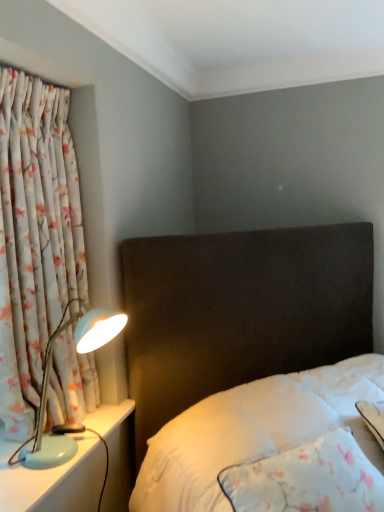
Question: In the image, is light blue plastic lamp at left on the left side or the right side of floral fabric curtain at left?

Choices:
 (A) left
 (B) right

Answer: (B)

Question: Relative to floral fabric curtain at left, is light blue plastic lamp at left in front or behind?

Choices:
 (A) front
 (B) behind

Answer: (B)

Question: From a real-world perspective, relative to floral fabric curtain at left, is light blue plastic lamp at left vertically above or below?

Choices:
 (A) above
 (B) below

Answer: (B)

Question: Choose the correct answer: Is floral fabric curtain at left inside light blue plastic lamp at left or outside it?

Choices:
 (A) inside
 (B) outside

Answer: (B)

Question: Is floral fabric curtain at left taller or shorter than light blue plastic lamp at left?

Choices:
 (A) short
 (B) tall

Answer: (B)

Question: Is floral fabric curtain at left wider or thinner than light blue plastic lamp at left?

Choices:
 (A) wide
 (B) thin

Answer: (B)

Question: Is floral fabric curtain at left to the left or to the right of light blue plastic lamp at left in the image?

Choices:
 (A) left
 (B) right

Answer: (A)